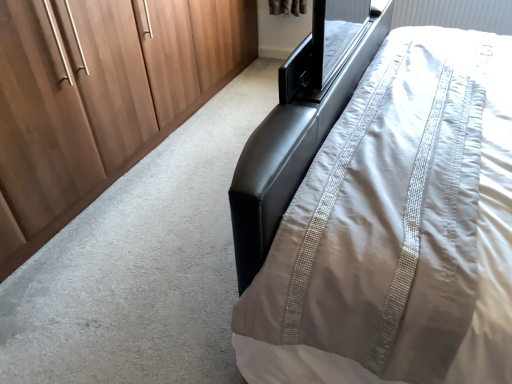
What is the approximate height of matte wood wardrobe at left?

The height of matte wood wardrobe at left is 1.02 meters.

Image resolution: width=512 pixels, height=384 pixels. In order to click on matte wood wardrobe at left in this screenshot , I will do `click(100, 97)`.

What do you see at coordinates (100, 97) in the screenshot?
I see `matte wood wardrobe at left` at bounding box center [100, 97].

Measure the distance between satin white bed at right and camera.

A distance of 85.71 centimeters exists between satin white bed at right and camera.

Locate an element on the screen. This screenshot has height=384, width=512. satin white bed at right is located at coordinates (397, 230).

This screenshot has height=384, width=512. What do you see at coordinates (397, 230) in the screenshot?
I see `satin white bed at right` at bounding box center [397, 230].

Image resolution: width=512 pixels, height=384 pixels. What are the coordinates of `matte wood wardrobe at left` in the screenshot? It's located at (100, 97).

Does matte wood wardrobe at left appear on the right side of satin white bed at right?

No, matte wood wardrobe at left is not to the right of satin white bed at right.

Between matte wood wardrobe at left and satin white bed at right, which one is positioned behind?

Answer: matte wood wardrobe at left is further from the camera.

Which is behind, point (46, 90) or point (384, 203)?

Point (46, 90)

Based on the photo, from the image's perspective, which object appears higher, matte wood wardrobe at left or satin white bed at right?

matte wood wardrobe at left is shown above in the image.

In the scene shown: From a real-world perspective, which object rests below the other?

From a 3D spatial view, matte wood wardrobe at left is below.

Which of these two, matte wood wardrobe at left or satin white bed at right, is wider?

matte wood wardrobe at left is wider.

Considering the relative sizes of matte wood wardrobe at left and satin white bed at right in the image provided, is matte wood wardrobe at left taller than satin white bed at right?

Indeed, matte wood wardrobe at left has a greater height compared to satin white bed at right.

Between matte wood wardrobe at left and satin white bed at right, which one has smaller size?

satin white bed at right is smaller.

Would you say matte wood wardrobe at left contains satin white bed at right?

Actually, satin white bed at right is outside matte wood wardrobe at left.

From the picture: Would you consider matte wood wardrobe at left to be distant from satin white bed at right?

matte wood wardrobe at left is positioned a significant distance from satin white bed at right.

Is matte wood wardrobe at left oriented towards satin white bed at right?

Yes, matte wood wardrobe at left is turned towards satin white bed at right.

Image resolution: width=512 pixels, height=384 pixels. I want to click on bed in front of the matte wood wardrobe at left, so click(397, 230).

Considering the positions of objects satin white bed at right and matte wood wardrobe at left in the image provided, who is more to the left, satin white bed at right or matte wood wardrobe at left?

matte wood wardrobe at left.

Considering their positions, is satin white bed at right located in front of or behind matte wood wardrobe at left?

Clearly, satin white bed at right is in front of matte wood wardrobe at left.

Is point (450, 314) less distant than point (89, 174)?

Yes.

From the image's perspective, does satin white bed at right appear higher than matte wood wardrobe at left?

Actually, satin white bed at right appears below matte wood wardrobe at left in the image.

From a real-world perspective, is satin white bed at right physically located above or below matte wood wardrobe at left?

From a real-world perspective, satin white bed at right is physically above matte wood wardrobe at left.

Looking at their sizes, would you say satin white bed at right is wider or thinner than matte wood wardrobe at left?

In the image, satin white bed at right appears to be more narrow than matte wood wardrobe at left.

Which of these two, satin white bed at right or matte wood wardrobe at left, stands taller?

With more height is matte wood wardrobe at left.

Looking at this image, which of these two, satin white bed at right or matte wood wardrobe at left, is bigger?

matte wood wardrobe at left is bigger.

Could matte wood wardrobe at left be considered to be inside satin white bed at right?

No, matte wood wardrobe at left is not inside satin white bed at right.

Are satin white bed at right and matte wood wardrobe at left making contact?

satin white bed at right and matte wood wardrobe at left are not in contact.

Is satin white bed at right looking in the opposite direction of matte wood wardrobe at left?

Yes, satin white bed at right is positioned with its back facing matte wood wardrobe at left.

What's the angular difference between satin white bed at right and matte wood wardrobe at left's facing directions?

1.41 degrees separate the facing orientations of satin white bed at right and matte wood wardrobe at left.

Identify the location of cupboard lying behind the satin white bed at right. (100, 97).

This screenshot has height=384, width=512. In the image, there is a satin white bed at right. Identify the location of cupboard below it (from a real-world perspective). (100, 97).

Where is `cupboard lying on the left of satin white bed at right`? cupboard lying on the left of satin white bed at right is located at coordinates (100, 97).